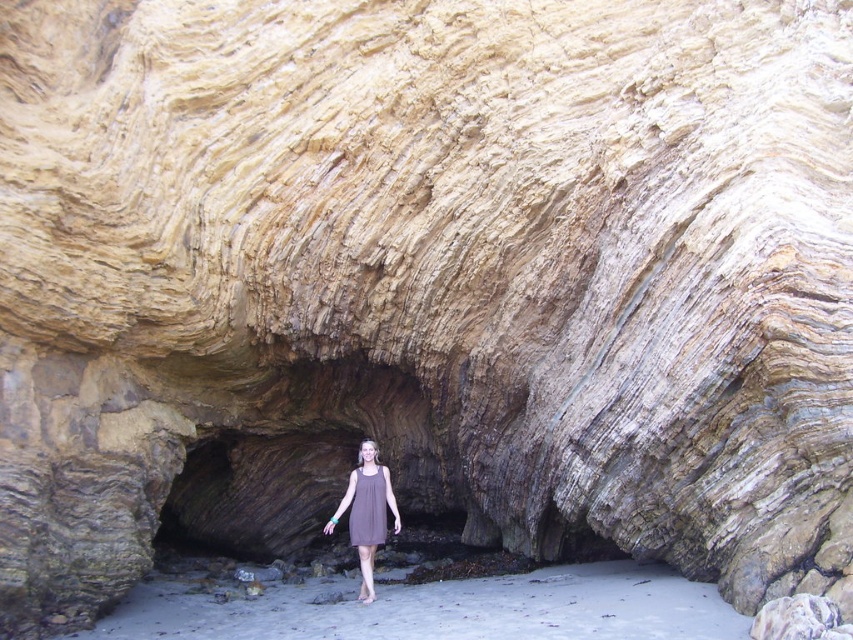
You are a hiker who wants to enter the cave. You see the sandy beach at lower center and the brown fabric dress at center. Which object is closer to the entrance of the cave?

The sandy beach at lower center is shorter than the brown fabric dress at center, so the sandy beach at lower center is closer to the entrance of the cave.

You are standing at the entrance of the rock formation and want to reach the sandy beach at lower center. Which direction should you walk relative to the brown fabric dress at center?

The sandy beach at lower center is to the right of the brown fabric dress at center, so you should walk towards the right side of the brown fabric dress at center to reach it.